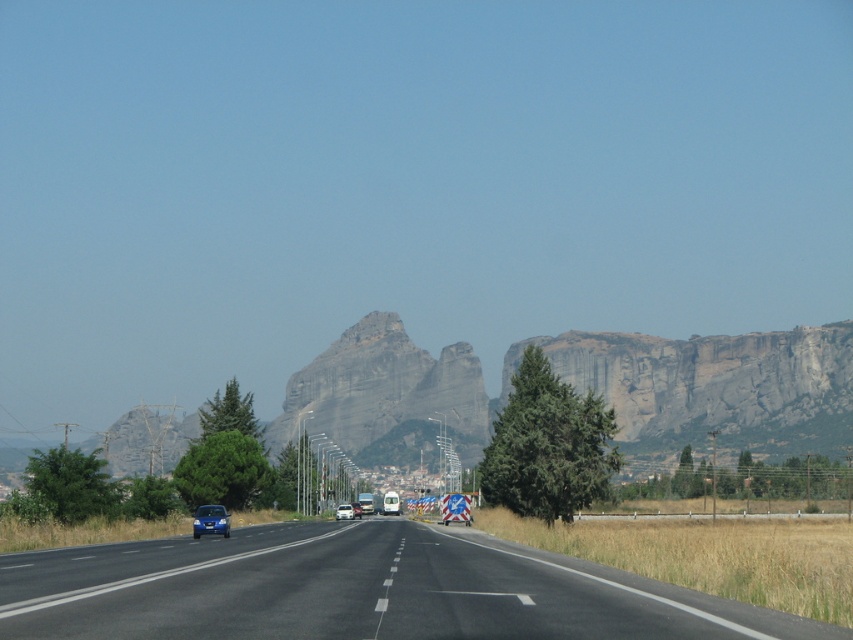
Question: Can you confirm if blue matte car at center is wider than blue metallic van at center?

Choices:
 (A) yes
 (B) no

Answer: (A)

Question: Can you confirm if blue matte car at center is thinner than blue metallic van at center?

Choices:
 (A) no
 (B) yes

Answer: (A)

Question: Which point appears closest to the camera in this image?

Choices:
 (A) (340, 515)
 (B) (132, 634)
 (C) (352, 508)
 (D) (212, 515)

Answer: (B)

Question: Does black asphalt highway at center have a smaller size compared to blue matte car at center?

Choices:
 (A) no
 (B) yes

Answer: (A)

Question: Which point is closer to the camera taking this photo?

Choices:
 (A) (360, 508)
 (B) (339, 515)
 (C) (221, 531)
 (D) (309, 588)

Answer: (D)

Question: Which of the following is the closest to the observer?

Choices:
 (A) metallic blue car at lower left
 (B) black asphalt highway at center

Answer: (B)